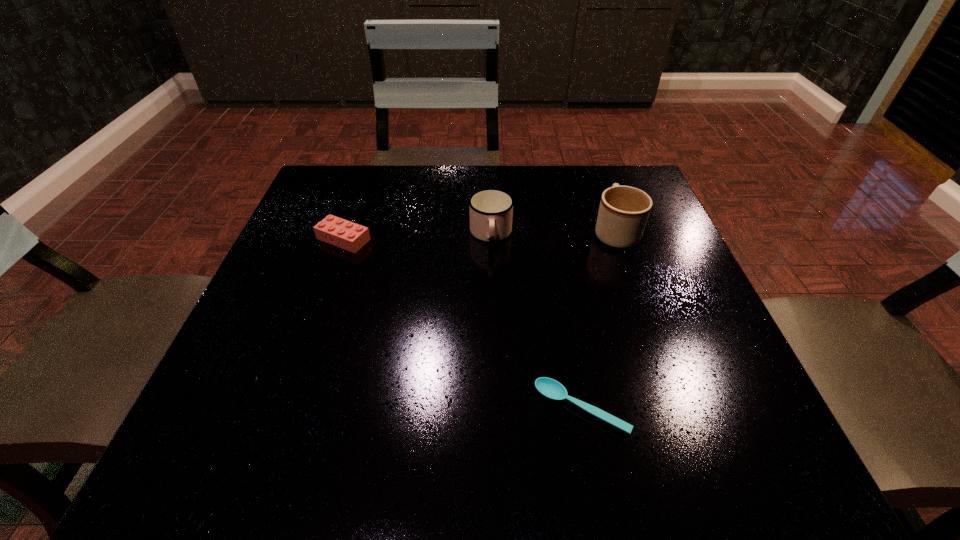
Find the location of a particular element. Image resolution: width=960 pixels, height=540 pixels. free area in between the right mug and the second object from left to right is located at coordinates (553, 233).

Where is `vacant region between the shorter mug and the right mug`? The height and width of the screenshot is (540, 960). vacant region between the shorter mug and the right mug is located at coordinates (553, 233).

At what (x,y) coordinates should I click in order to perform the action: click on free point between the third tallest object and the nearest object. Please return your answer as a coordinate pair (x, y). Looking at the image, I should click on (463, 324).

This screenshot has width=960, height=540. I want to click on free area in between the Lego and the shortest object, so click(463, 324).

Select which object appears as the third closest to the leftmost object. Please provide its 2D coordinates. Your answer should be formatted as a tuple, i.e. [(x, y)], where the tuple contains the x and y coordinates of a point satisfying the conditions above.

[(623, 213)]

Locate which object is the second closest to the Lego. Please provide its 2D coordinates. Your answer should be formatted as a tuple, i.e. [(x, y)], where the tuple contains the x and y coordinates of a point satisfying the conditions above.

[(550, 388)]

Identify the location of vacant region that satisfies the following two spatial constraints: 1. on the side of the shorter mug with the handle; 2. on the right side of the shortest object. Image resolution: width=960 pixels, height=540 pixels. (495, 408).

Where is `free spot that satisfies the following two spatial constraints: 1. on the front side of the spoon; 2. on the left side of the third tallest object`? The width and height of the screenshot is (960, 540). free spot that satisfies the following two spatial constraints: 1. on the front side of the spoon; 2. on the left side of the third tallest object is located at coordinates (284, 408).

You are a GUI agent. You are given a task and a screenshot of the screen. Output one action in this format:
    pyautogui.click(x=<x>, y=<y>)
    Task: Click on the vacant point that satisfies the following two spatial constraints: 1. on the side of the shorter mug with the handle; 2. on the left side of the third object from left to right
    This screenshot has height=540, width=960.
    Given the screenshot: What is the action you would take?
    pyautogui.click(x=495, y=408)